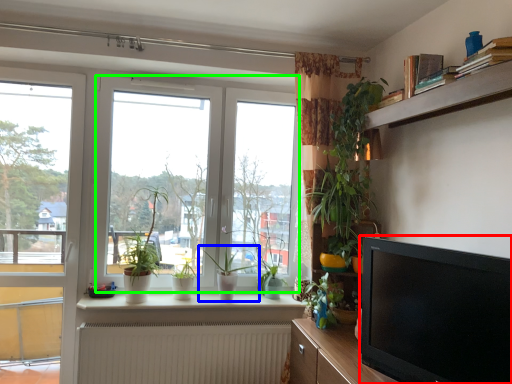
Question: Considering the real-world distances, which object is closest to television (highlighted by a red box)? houseplant (highlighted by a blue box) or window (highlighted by a green box).

Choices:
 (A) houseplant
 (B) window

Answer: (A)